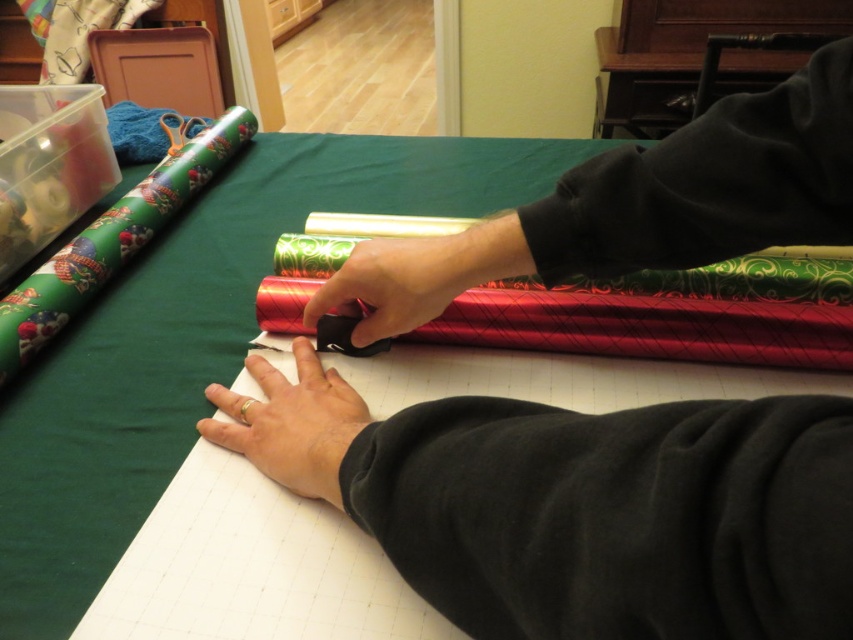
Question: Is gold ring at lower center closer to camera compared to black matte scissors at center?

Choices:
 (A) yes
 (B) no

Answer: (A)

Question: Can you confirm if black fleece at lower right is wider than gold ring at lower center?

Choices:
 (A) yes
 (B) no

Answer: (A)

Question: Considering the real-world distances, which object is closest to the black fleece at lower right?

Choices:
 (A) black matte scissors at center
 (B) green fabric at upper right

Answer: (A)

Question: Can you confirm if black fleece at lower right is smaller than gold ring at lower center?

Choices:
 (A) yes
 (B) no

Answer: (B)

Question: Among these points, which one is farthest from the camera?

Choices:
 (A) (326, 458)
 (B) (497, 401)

Answer: (A)

Question: Based on their relative distances, which object is nearer to the black matte scissors at center?

Choices:
 (A) black fleece at lower right
 (B) green fabric at upper right

Answer: (B)